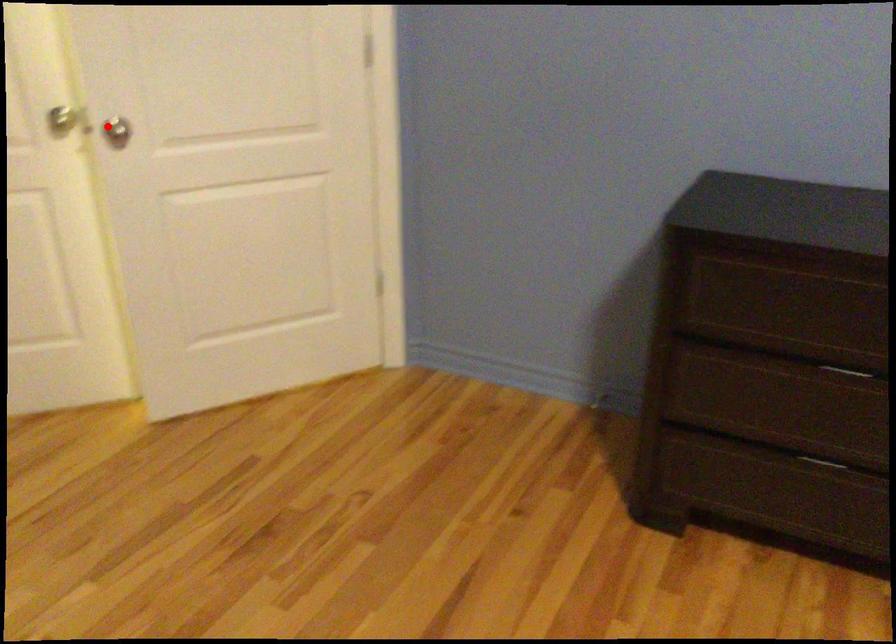
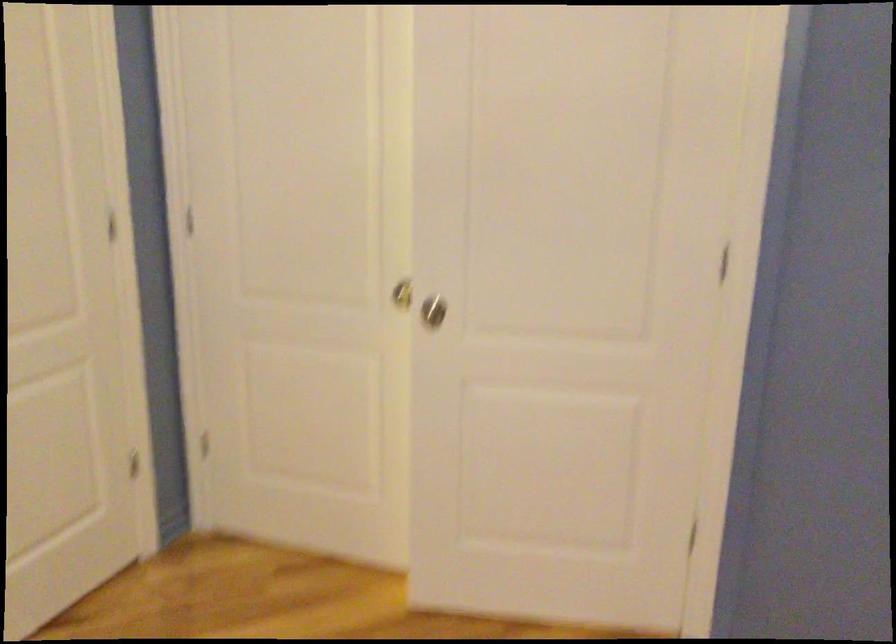
Find the pixel in the second image that matches the highlighted location in the first image.

(433, 310)